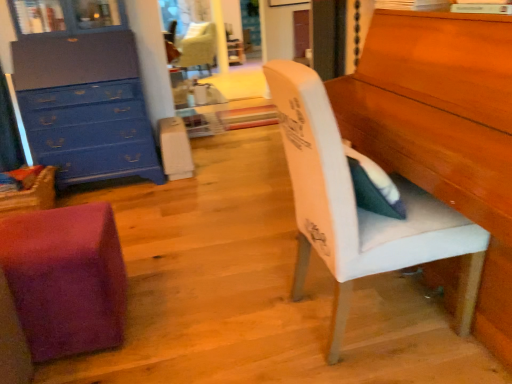
Question: Relative to purple fuzzy cube at lower left, arranged as the second chair when viewed from the front, is blue painted wood chest of drawers at upper left in front or behind?

Choices:
 (A) behind
 (B) front

Answer: (A)

Question: In terms of height, does blue painted wood chest of drawers at upper left look taller or shorter compared to purple fuzzy cube at lower left, which is counted as the second chair, starting from the right?

Choices:
 (A) tall
 (B) short

Answer: (A)

Question: Considering the real-world distances, which object is closest to the velvet cream chair at upper center, the first chair from the top?

Choices:
 (A) blue painted wood chest of drawers at upper left
 (B) white fabric chair at right, placed as the 1th chair when sorted from right to left
 (C) purple fuzzy cube at lower left, which ranks as the first chair in bottom-to-top order

Answer: (A)

Question: Which object is the closest to the blue painted wood chest of drawers at upper left?

Choices:
 (A) velvet cream chair at upper center, the third chair positioned from the front
 (B) purple fuzzy cube at lower left, which ranks as the first chair in bottom-to-top order
 (C) white fabric chair at right, which is the third chair from back to front

Answer: (B)